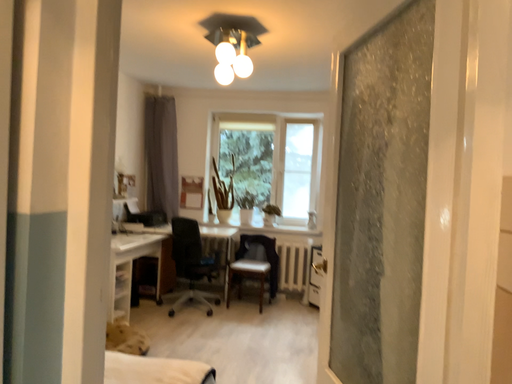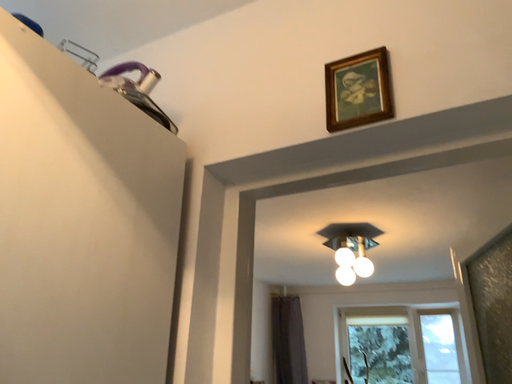
Question: How did the camera likely rotate when shooting the video?

Choices:
 (A) rotated right
 (B) rotated left

Answer: (B)